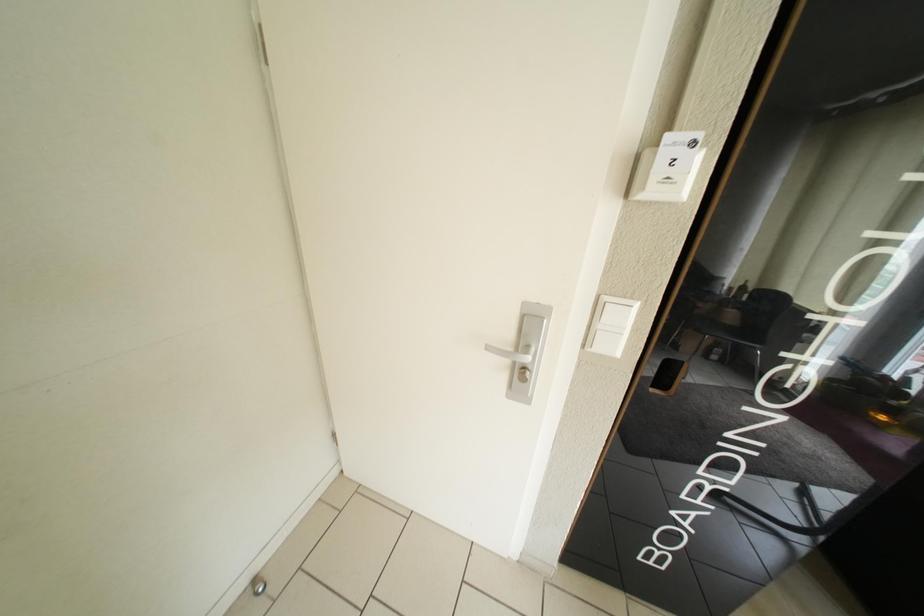
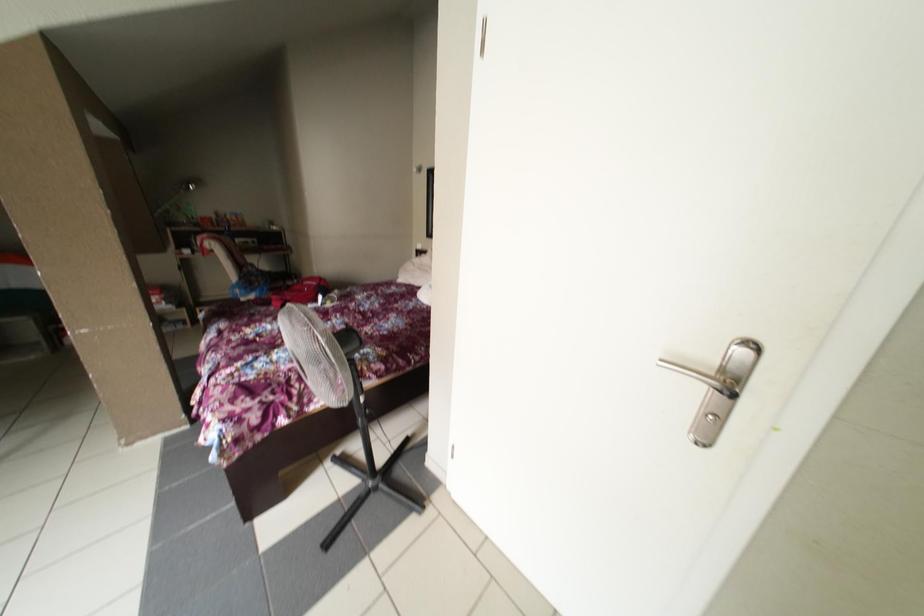
The first image is from the beginning of the video and the second image is from the end. How did the camera likely rotate when shooting the video?

The rotation direction of the camera is left-down.